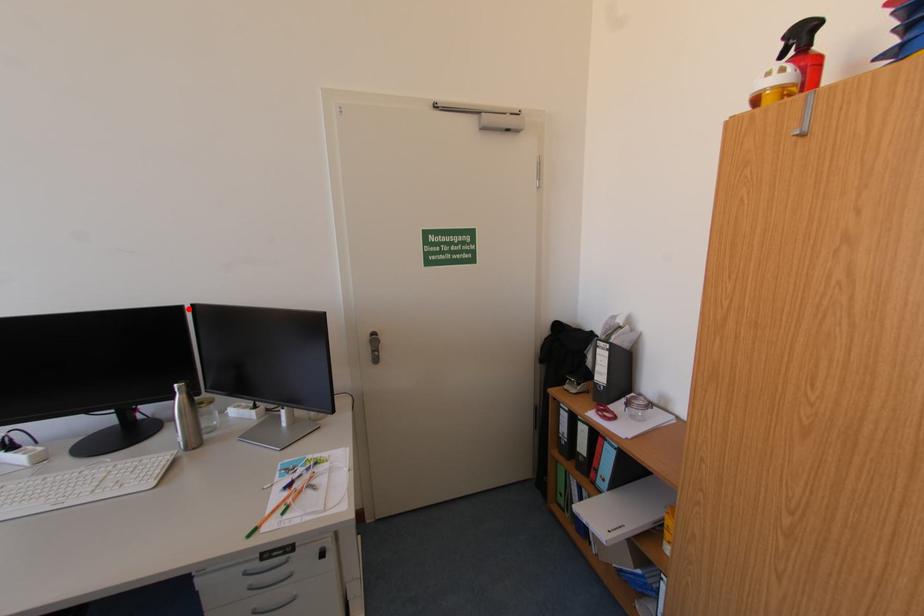
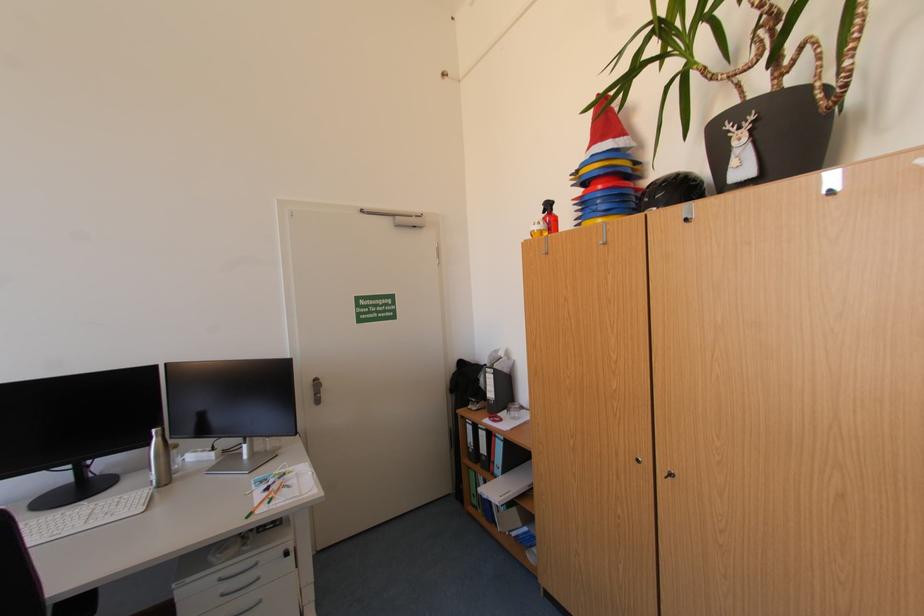
Locate, in the second image, the point that corresponds to the highlighted location in the first image.

(164, 368)